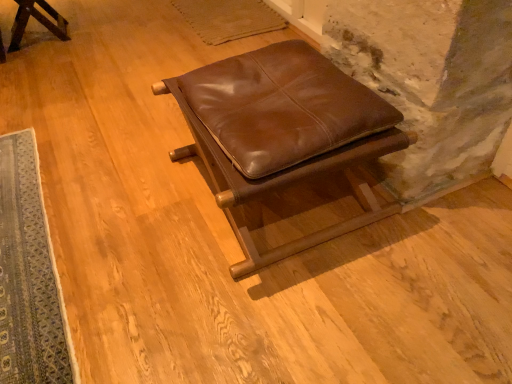
Find the location of a particular element. The image size is (512, 384). free space in front of brown leather ottoman at center, which is the first furniture in right-to-left order is located at coordinates (288, 312).